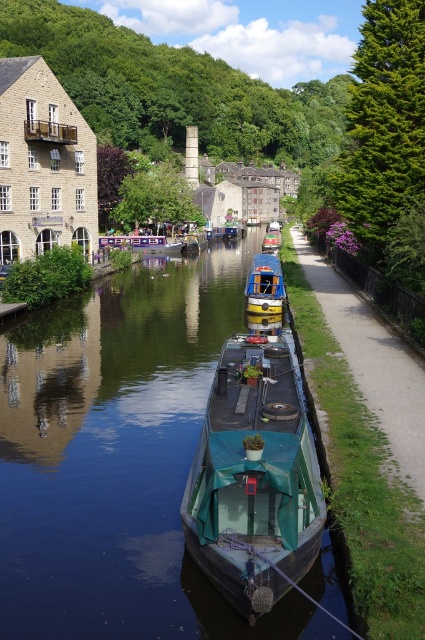
Question: Which point is closer to the camera?

Choices:
 (A) green canvas boat at center
 (B) smooth dark water at center
 (C) teal canvas boat at center

Answer: (C)

Question: Is teal canvas boat at center wider than green canvas boat at center?

Choices:
 (A) yes
 (B) no

Answer: (B)

Question: Does green canvas boat at center have a greater width compared to teal fabric boat at center?

Choices:
 (A) no
 (B) yes

Answer: (B)

Question: Does green canvas boat at center appear on the right side of teal fabric boat at center?

Choices:
 (A) yes
 (B) no

Answer: (A)

Question: Which point is farther to the camera?

Choices:
 (A) green canvas boat at center
 (B) smooth dark water at center
 (C) teal canvas boat at center

Answer: (A)

Question: Based on their relative distances, which object is nearer to the green canvas boat at center?

Choices:
 (A) smooth dark water at center
 (B) teal fabric boat at center
 (C) teal canvas boat at center

Answer: (C)